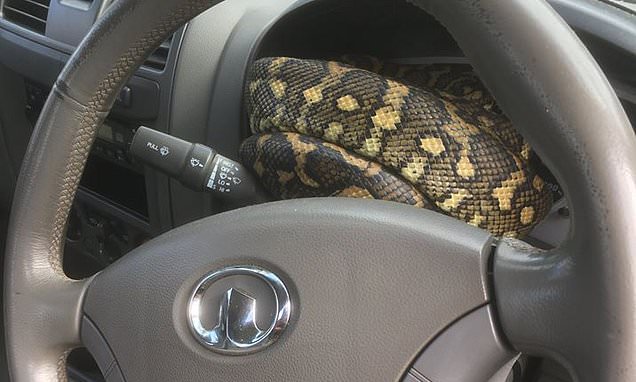
You are a GUI agent. You are given a task and a screenshot of the screen. Output one action in this format:
    pyautogui.click(x=<x>, y=<y>)
    Task: Click on the light indicator
    
    Given the screenshot: What is the action you would take?
    pyautogui.click(x=176, y=159)